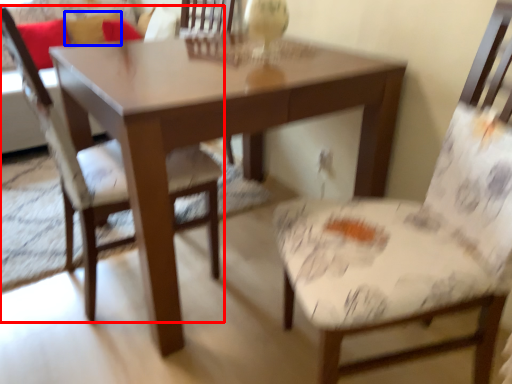
Question: Among these objects, which one is farthest to the camera, chair (highlighted by a red box) or pillow (highlighted by a blue box)?

Choices:
 (A) chair
 (B) pillow

Answer: (B)